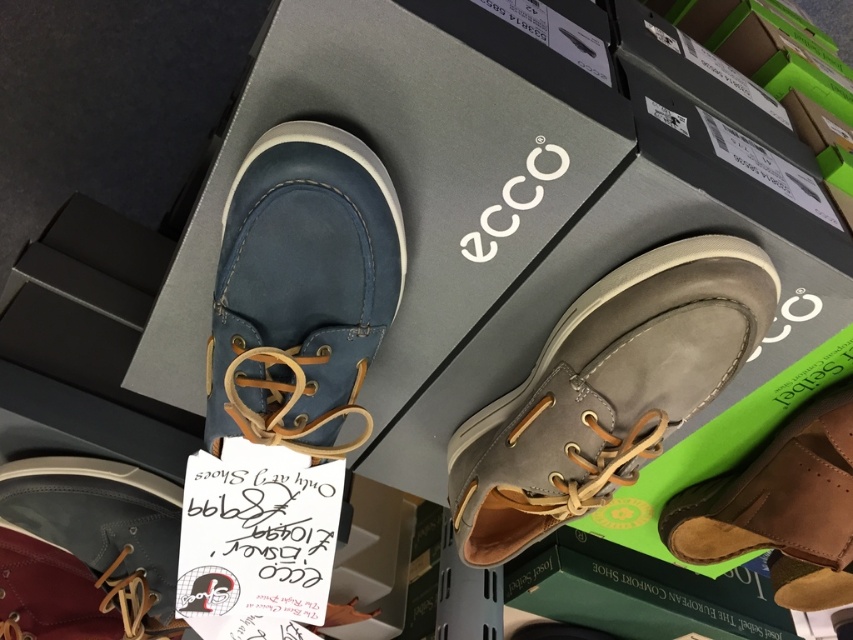
You are a customer browsing the ECCO shoe display. You see the gray suede shoe at center and the matte blue leather shoe at upper left. Which shoe is closer to you?

The gray suede shoe at center is closer to you because it is further to the viewer than the matte blue leather shoe at upper left.

You are a customer looking at the ECCO shoe display. You see the gray suede shoe at center and the matte blue leather shoe at upper left. Which shoe is positioned to the right of the other?

The gray suede shoe at center is positioned to the right of the matte blue leather shoe at upper left.

You are a customer in a shoe store looking at the gray suede shoe at center and the brown leather shoe at lower right. Which shoe is positioned closer to the left side of the display?

The gray suede shoe at center is positioned closer to the left side of the display than the brown leather shoe at lower right.